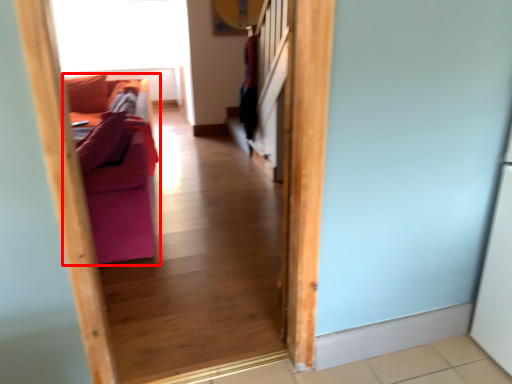
Question: From the image's perspective, what is the correct spatial positioning of furniture (annotated by the red box) in reference to window screen?

Choices:
 (A) below
 (B) above

Answer: (A)